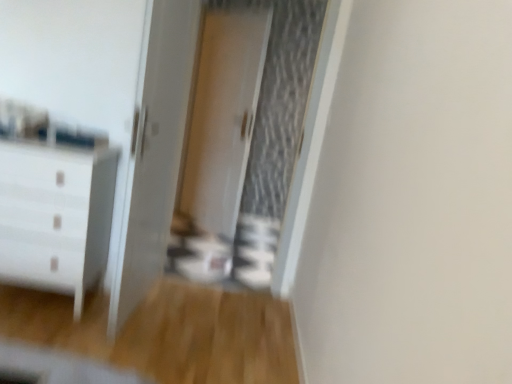
Question: Considering their positions, is white glossy door at center located in front of or behind white glossy chest of drawers at left?

Choices:
 (A) front
 (B) behind

Answer: (A)

Question: From the image's perspective, is white glossy door at center above or below white glossy chest of drawers at left?

Choices:
 (A) below
 (B) above

Answer: (B)

Question: Estimate the real-world distances between objects in this image. Which object is closer to the white glossy door at center, the 2th screen door viewed from the front?

Choices:
 (A) white glossy door at center
 (B) white glossy screen door at center, the first screen door in the front-to-back sequence
 (C) white glossy chest of drawers at left

Answer: (B)

Question: Estimate the real-world distances between objects in this image. Which object is farther from the white glossy screen door at center, the first screen door in the front-to-back sequence?

Choices:
 (A) white glossy door at center
 (B) white glossy door at center, the first screen door positioned from the back
 (C) white glossy chest of drawers at left

Answer: (C)